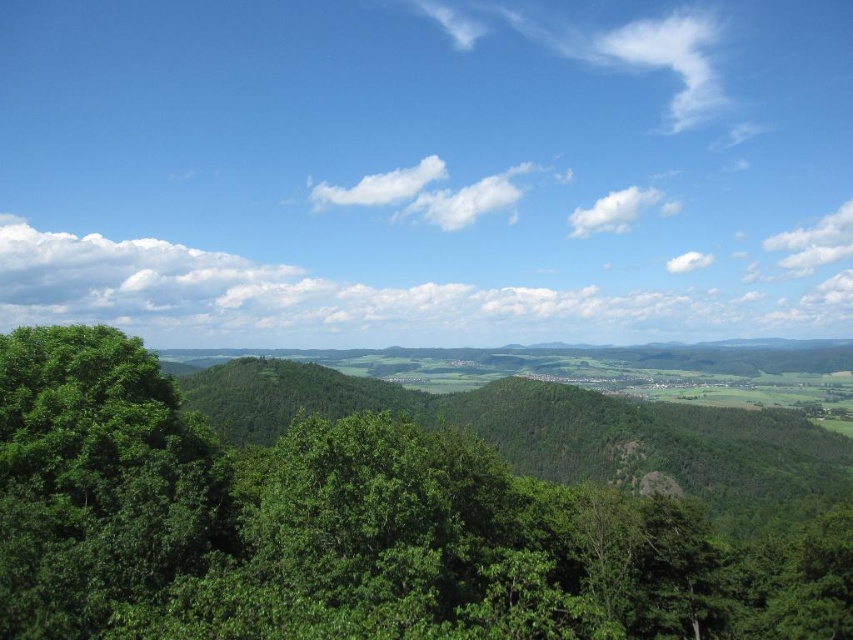
Question: Which point is closer to the camera?

Choices:
 (A) green leafy tree at center
 (B) green leafy tree at left

Answer: (A)

Question: From the image, what is the correct spatial relationship of green leafy tree at center in relation to green leafy tree at left?

Choices:
 (A) right
 (B) left

Answer: (A)

Question: Is green leafy tree at center to the left of green leafy tree at left from the viewer's perspective?

Choices:
 (A) no
 (B) yes

Answer: (A)

Question: Does green leafy tree at center appear on the right side of green leafy tree at left?

Choices:
 (A) yes
 (B) no

Answer: (A)

Question: Among these objects, which one is nearest to the camera?

Choices:
 (A) green leafy tree at left
 (B) green leafy tree at center

Answer: (B)

Question: Which of the following is the closest to the observer?

Choices:
 (A) green leafy tree at center
 (B) green leafy tree at left

Answer: (A)